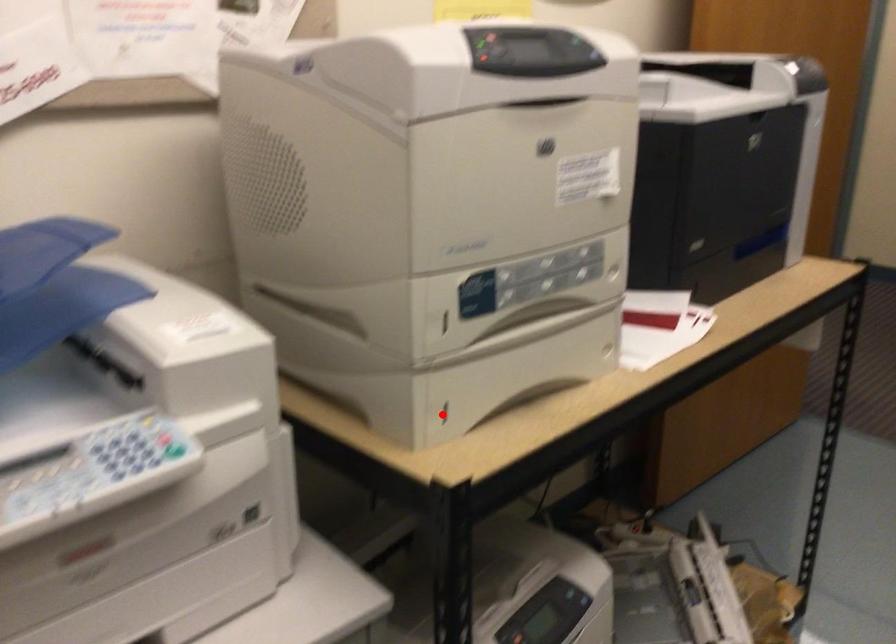
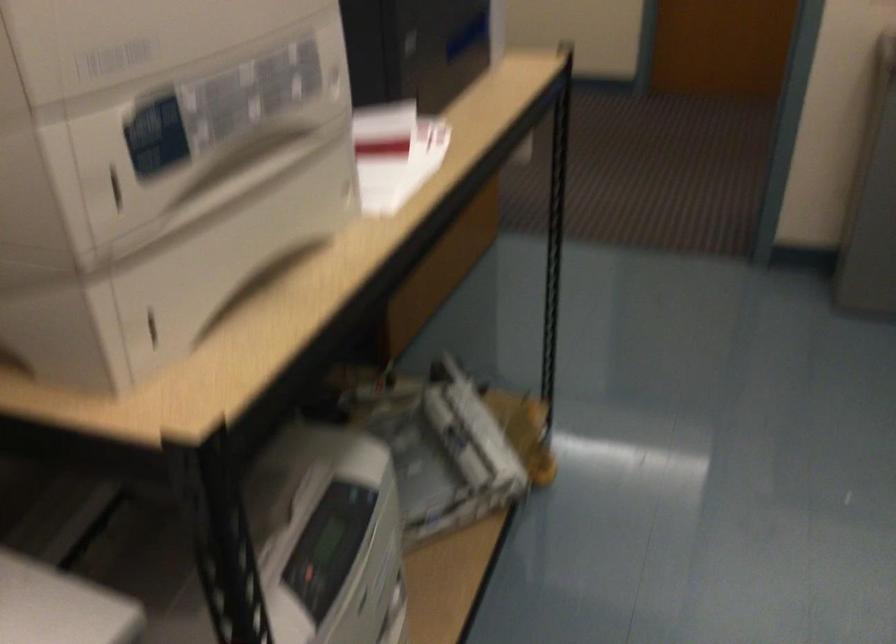
Question: I am providing you with two images of the same scene from different viewpoints. Given a red point in image1, look at the same physical point in image2. Is it:

Choices:
 (A) Closer to the viewpoint
 (B) Farther from the viewpoint

Answer: (A)